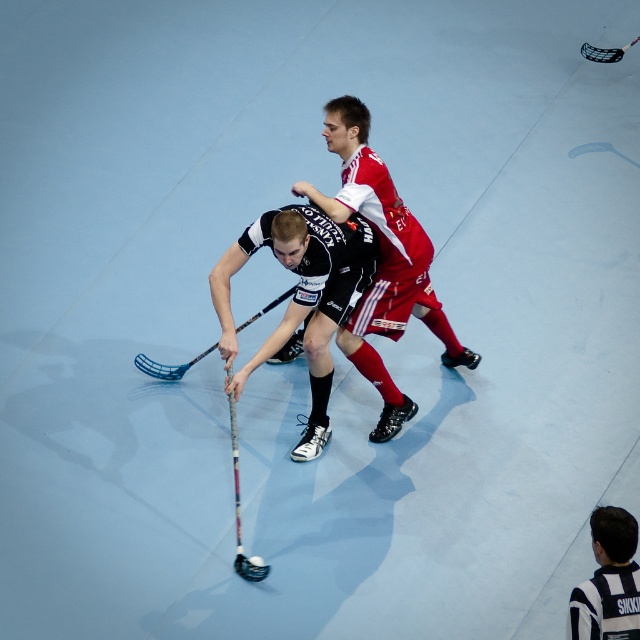
You are an AI analyzing the floorball match. The floor is a smooth light blue surface. You need to locate the black matte hockey stick at center. What are its coordinates?

The coordinates of the black matte hockey stick at center are at point (301,296).

You are a referee in this floorball match. You need to determine if the ball is within the playing area. The playing area is defined as the area where the coordinates are between 0.0 and 1.0 in both x and y axes. The ball is located at point (609, 580). Is the ball inside the playing area?

The ball is located at point (609, 580), which falls within the coordinates between 0.0 and 1.0 in both x and y axes. Therefore, the ball is inside the playing area.